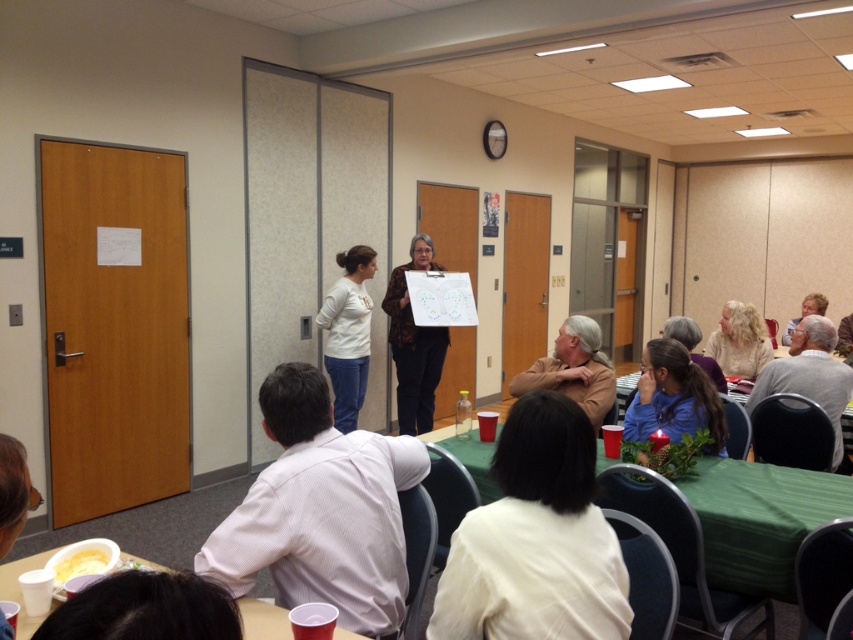
Question: Which of the following is the farthest from the observer?

Choices:
 (A) green fabric table at lower center
 (B) white textured shirt at center
 (C) white matte shirt at lower center
 (D) light brown hair at upper right

Answer: (D)

Question: Considering the relative positions of green fabric table at lower center and light brown hair at upper right in the image provided, where is green fabric table at lower center located with respect to light brown hair at upper right?

Choices:
 (A) left
 (B) right

Answer: (A)

Question: Considering the real-world distances, which object is closest to the plastic disposable cup at lower left?

Choices:
 (A) white textured shirt at center
 (B) gray sweater at lower right
 (C) white matte sweater at center
 (D) blue matte shirt at lower right

Answer: (A)

Question: Which is nearer to the plastic disposable cup at lower left?

Choices:
 (A) white matte sweater at center
 (B) light brown hair at upper right
 (C) blonde hair at lower right
 (D) floral-patterned fabric at center

Answer: (A)

Question: Can you confirm if white matte sweater at center is bigger than plastic disposable cup at lower left?

Choices:
 (A) yes
 (B) no

Answer: (A)

Question: Does white matte sweater at center appear on the left side of brown leather jacket at center?

Choices:
 (A) yes
 (B) no

Answer: (A)